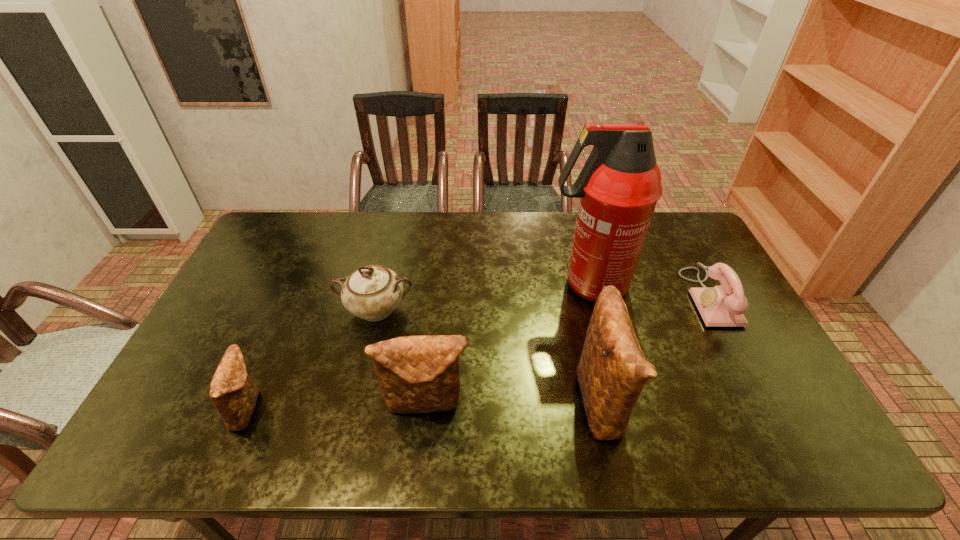
Identify the location of vacant area between the fire extinguisher and the second clutch bag from left to right. The width and height of the screenshot is (960, 540). (507, 344).

Identify the location of vacant region between the leftmost clutch bag and the third tallest object. (337, 406).

The height and width of the screenshot is (540, 960). In order to click on the second closest object to the telephone in this screenshot , I will do `click(612, 371)`.

Where is `object that stands as the second closest to the rightmost object`? The width and height of the screenshot is (960, 540). object that stands as the second closest to the rightmost object is located at coordinates (612, 371).

Select which clutch bag is the closest to the telephone. Please provide its 2D coordinates. Your answer should be formatted as a tuple, i.e. [(x, y)], where the tuple contains the x and y coordinates of a point satisfying the conditions above.

[(612, 371)]

Choose which clutch bag is the second nearest neighbor to the leftmost object. Please provide its 2D coordinates. Your answer should be formatted as a tuple, i.e. [(x, y)], where the tuple contains the x and y coordinates of a point satisfying the conditions above.

[(612, 371)]

Image resolution: width=960 pixels, height=540 pixels. What are the coordinates of `vacant region that satisfies the following two spatial constraints: 1. on the trigger side of the fire extinguisher; 2. on the open side of the second tallest clutch bag` in the screenshot? It's located at (618, 403).

Identify the location of blank area in the image that satisfies the following two spatial constraints: 1. on the trigger side of the tallest object; 2. on the front side of the chinaware. (594, 309).